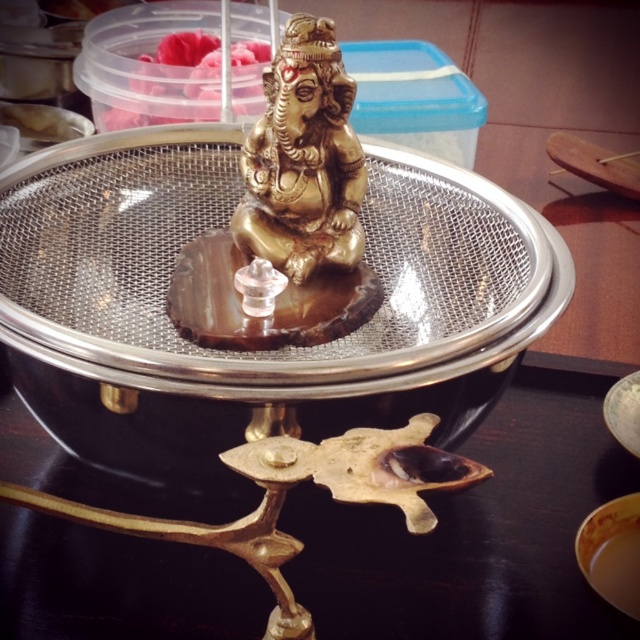
Question: Can you confirm if metallic gold table at center is smaller than gold polished statue at center?

Choices:
 (A) yes
 (B) no

Answer: (B)

Question: Which object is farther from the camera taking this photo?

Choices:
 (A) gold polished statue at center
 (B) pink soft food at center
 (C) metallic gold table at center

Answer: (B)

Question: Among these objects, which one is farthest from the camera?

Choices:
 (A) pink soft food at center
 (B) gold polished statue at center
 (C) metallic gold table at center

Answer: (A)

Question: Does gold polished statue at center have a smaller size compared to pink soft food at center?

Choices:
 (A) yes
 (B) no

Answer: (B)

Question: Which of the following is the closest to the observer?

Choices:
 (A) (148, 64)
 (B) (115, 593)
 (C) (310, 280)

Answer: (B)

Question: Is metallic gold table at center positioned at the back of pink soft food at center?

Choices:
 (A) no
 (B) yes

Answer: (A)